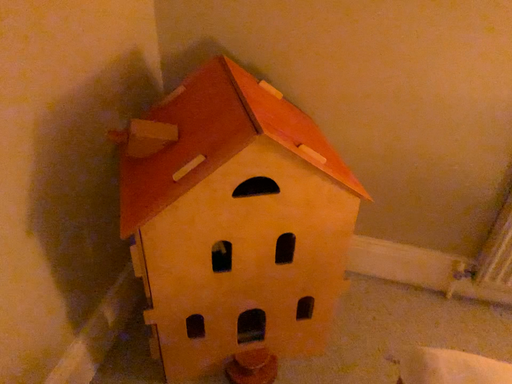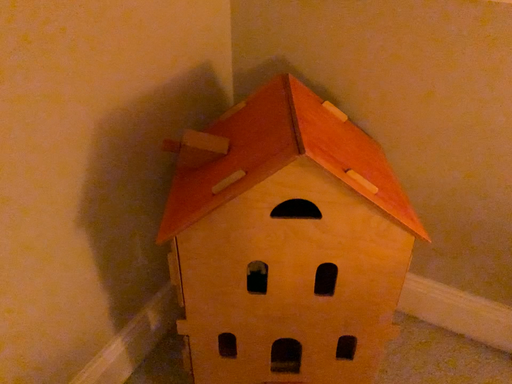
Question: How did the camera likely rotate when shooting the video?

Choices:
 (A) rotated right
 (B) rotated left

Answer: (B)